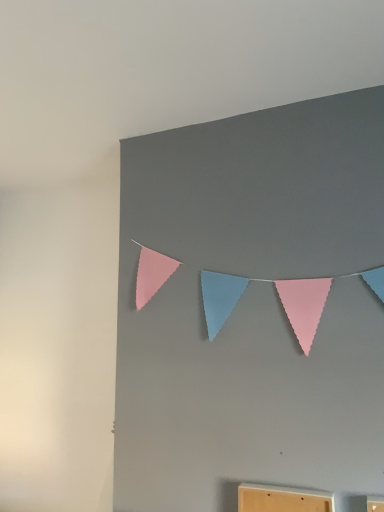
Describe the element at coordinates (282, 499) in the screenshot. I see `wooden cabinet at lower center` at that location.

Where is `wooden cabinet at lower center`? The image size is (384, 512). wooden cabinet at lower center is located at coordinates (282, 499).

Describe the element at coordinates (304, 306) in the screenshot. I see `pastel felt bunting at upper center` at that location.

Locate an element on the screen. The image size is (384, 512). pastel felt bunting at upper center is located at coordinates (304, 306).

The image size is (384, 512). Identify the location of wooden cabinet at lower center. (282, 499).

Which object is positioned more to the left, pastel felt bunting at upper center or wooden cabinet at lower center?

From the viewer's perspective, pastel felt bunting at upper center appears more on the left side.

Which object is more forward, pastel felt bunting at upper center or wooden cabinet at lower center?

wooden cabinet at lower center is closer to the camera.

Does point (235, 293) come in front of point (309, 503)?

No, it is not.

From the image's perspective, which is above, pastel felt bunting at upper center or wooden cabinet at lower center?

pastel felt bunting at upper center, from the image's perspective.

From a real-world perspective, which object stands above the other?

A: pastel felt bunting at upper center is physically above.

Is pastel felt bunting at upper center wider than wooden cabinet at lower center?

No.

Considering the relative sizes of pastel felt bunting at upper center and wooden cabinet at lower center in the image provided, is pastel felt bunting at upper center taller than wooden cabinet at lower center?

Yes.

Considering the sizes of objects pastel felt bunting at upper center and wooden cabinet at lower center in the image provided, who is smaller, pastel felt bunting at upper center or wooden cabinet at lower center?

wooden cabinet at lower center.

Which is correct: pastel felt bunting at upper center is inside wooden cabinet at lower center, or outside of it?

pastel felt bunting at upper center exists outside the volume of wooden cabinet at lower center.

Would you consider pastel felt bunting at upper center to be distant from wooden cabinet at lower center?

They are positioned close to each other.

Is pastel felt bunting at upper center oriented towards wooden cabinet at lower center?

No, pastel felt bunting at upper center is not oriented towards wooden cabinet at lower center.

How far apart are pastel felt bunting at upper center and wooden cabinet at lower center?

They are 51.09 centimeters apart.

Locate an element on the screen. This screenshot has width=384, height=512. furniture lying below the pastel felt bunting at upper center (from the image's perspective) is located at coordinates (282, 499).

Considering the positions of objects wooden cabinet at lower center and pastel felt bunting at upper center in the image provided, who is more to the right, wooden cabinet at lower center or pastel felt bunting at upper center?

From the viewer's perspective, wooden cabinet at lower center appears more on the right side.

Is wooden cabinet at lower center positioned before pastel felt bunting at upper center?

Yes, the depth of wooden cabinet at lower center is less than that of pastel felt bunting at upper center.

Is point (250, 484) less distant than point (149, 271)?

Yes, it is in front of point (149, 271).

In the scene shown: From the image's perspective, relative to pastel felt bunting at upper center, is wooden cabinet at lower center above or below?

wooden cabinet at lower center is situated lower than pastel felt bunting at upper center in the image.

From a real-world perspective, who is located lower, wooden cabinet at lower center or pastel felt bunting at upper center?

In real-world perspective, wooden cabinet at lower center is lower.

Can you confirm if wooden cabinet at lower center is wider than pastel felt bunting at upper center?

Yes, wooden cabinet at lower center is wider than pastel felt bunting at upper center.

Is wooden cabinet at lower center taller or shorter than pastel felt bunting at upper center?

Clearly, wooden cabinet at lower center is shorter compared to pastel felt bunting at upper center.

Who is bigger, wooden cabinet at lower center or pastel felt bunting at upper center?

pastel felt bunting at upper center.

Is pastel felt bunting at upper center a part of wooden cabinet at lower center?

Actually, pastel felt bunting at upper center is outside wooden cabinet at lower center.

From the picture: Is wooden cabinet at lower center positioned far away from pastel felt bunting at upper center?

No.

Is wooden cabinet at lower center positioned with its back to pastel felt bunting at upper center?

No, wooden cabinet at lower center is not facing away from pastel felt bunting at upper center.

How many degrees apart are the facing directions of wooden cabinet at lower center and pastel felt bunting at upper center?

wooden cabinet at lower center and pastel felt bunting at upper center are facing 0.484 degrees away from each other.

I want to click on furniture that is below the pastel felt bunting at upper center (from the image's perspective), so click(x=282, y=499).

The width and height of the screenshot is (384, 512). Find the location of `clothesline that is on the left side of wooden cabinet at lower center`. clothesline that is on the left side of wooden cabinet at lower center is located at coordinates (304, 306).

This screenshot has width=384, height=512. I want to click on furniture that is below the pastel felt bunting at upper center (from the image's perspective), so click(x=282, y=499).